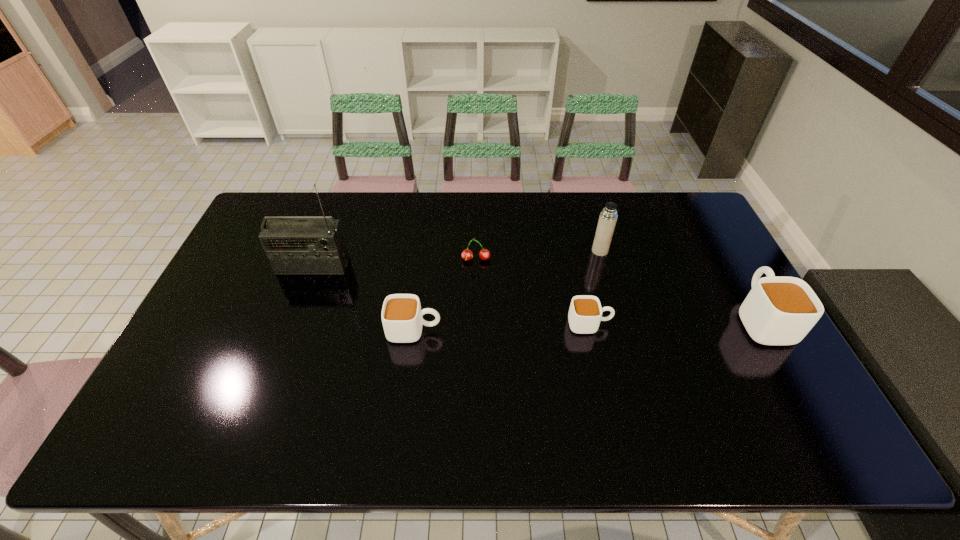
Observe the arrangement of all cups in the image. To keep them evenly spaced, where would you place another cup on the left? Please locate a free space. Please provide its 2D coordinates. Your answer should be formatted as a tuple, i.e. [(x, y)], where the tuple contains the x and y coordinates of a point satisfying the conditions above.

[(234, 337)]